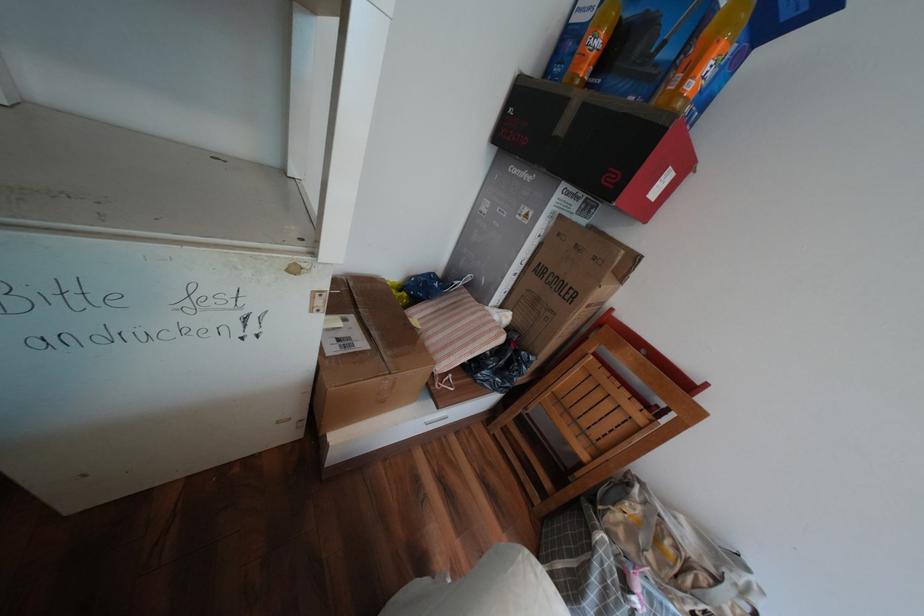
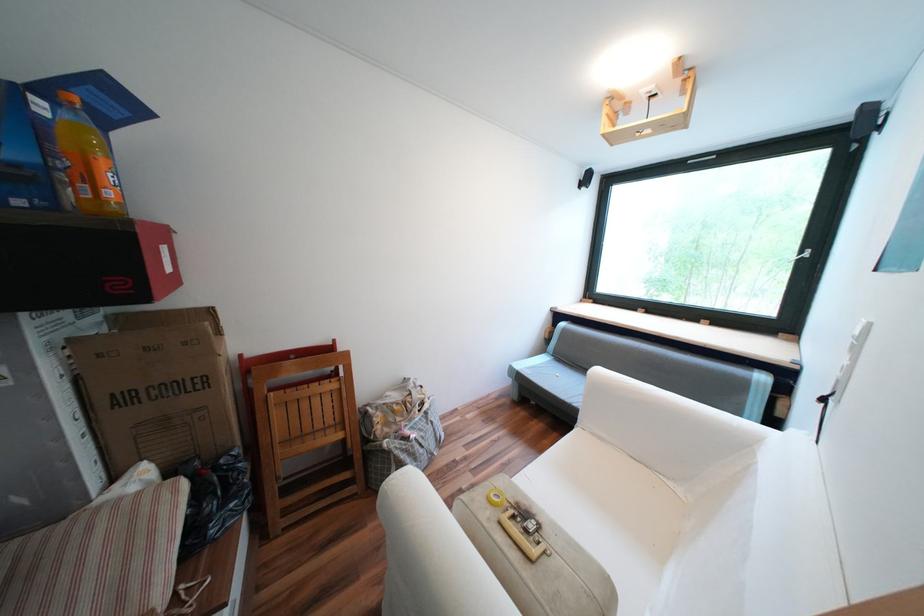
Locate, in the second image, the point that corresponds to point (699, 87) in the first image.

(118, 193)